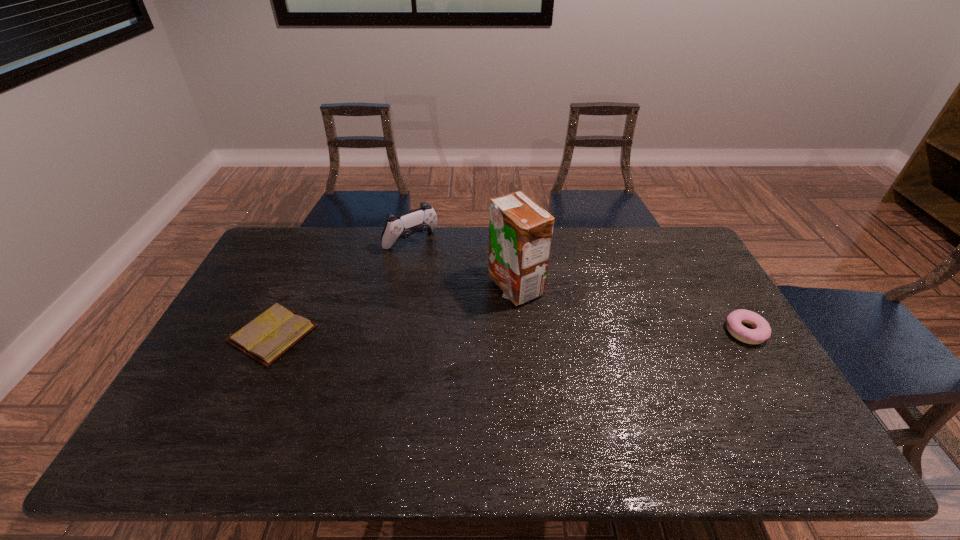
What are the coordinates of `vacant area that lies between the tallest object and the second tallest object` in the screenshot? It's located at (463, 264).

You are a GUI agent. You are given a task and a screenshot of the screen. Output one action in this format:
    pyautogui.click(x=<x>, y=<y>)
    Task: Click on the free space between the third shortest object and the carton
    Image resolution: width=960 pixels, height=540 pixels.
    Given the screenshot: What is the action you would take?
    [463, 264]

At what (x,y) coordinates should I click in order to perform the action: click on free space between the rightmost object and the tallest object. Please return your answer as a coordinate pair (x, y). This screenshot has height=540, width=960. Looking at the image, I should click on (630, 309).

Find the location of `free space between the leftmost object and the doughnut`. free space between the leftmost object and the doughnut is located at coordinates tap(510, 333).

Where is `free space between the third shortest object and the shortest object`? This screenshot has width=960, height=540. free space between the third shortest object and the shortest object is located at coordinates (342, 288).

At what (x,y) coordinates should I click in order to perform the action: click on empty space between the second object from right to left and the diary. Please return your answer as a coordinate pair (x, y). The height and width of the screenshot is (540, 960). Looking at the image, I should click on (394, 310).

Point out which object is positioned as the third nearest to the third object from right to left. Please provide its 2D coordinates. Your answer should be formatted as a tuple, i.e. [(x, y)], where the tuple contains the x and y coordinates of a point satisfying the conditions above.

[(761, 331)]

Locate which object ranks in proximity to the diary. Please provide its 2D coordinates. Your answer should be formatted as a tuple, i.e. [(x, y)], where the tuple contains the x and y coordinates of a point satisfying the conditions above.

[(423, 219)]

Locate an element on the screen. free location that satisfies the following two spatial constraints: 1. on the back side of the diary; 2. on the left side of the third object from left to right is located at coordinates (296, 287).